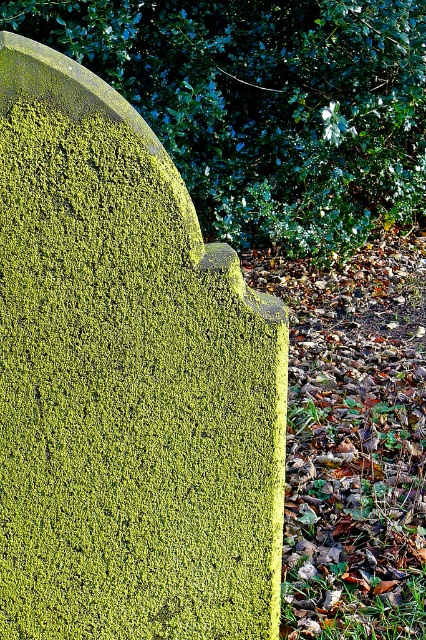
Question: Can you confirm if green mossy gravestone at center is bigger than green mossy stone at upper center?

Choices:
 (A) yes
 (B) no

Answer: (B)

Question: Which point appears farthest from the camera in this image?

Choices:
 (A) (215, 301)
 (B) (397, 118)

Answer: (B)

Question: Is the position of green mossy gravestone at center less distant than that of green mossy stone at upper center?

Choices:
 (A) no
 (B) yes

Answer: (B)

Question: Which object is farther from the camera taking this photo?

Choices:
 (A) green mossy gravestone at center
 (B) green mossy stone at upper center

Answer: (B)

Question: Does green mossy gravestone at center appear over green mossy stone at upper center?

Choices:
 (A) yes
 (B) no

Answer: (B)